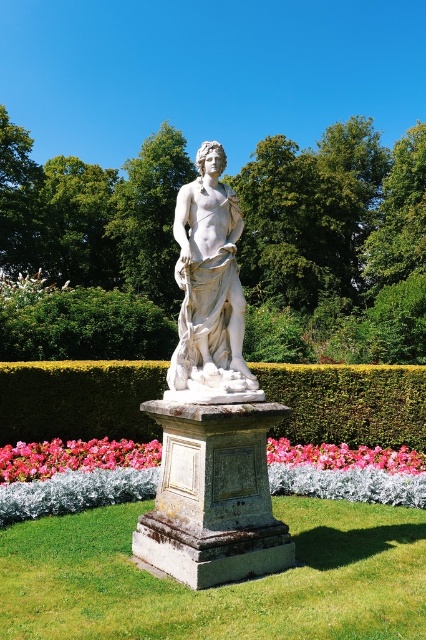
Question: Considering the relative positions of pink fabric flower at lower center and pink floral bed at lower center in the image provided, where is pink fabric flower at lower center located with respect to pink floral bed at lower center?

Choices:
 (A) above
 (B) below

Answer: (A)

Question: Which point appears closest to the camera in this image?

Choices:
 (A) (x=339, y=461)
 (B) (x=353, y=435)
 (C) (x=229, y=388)

Answer: (C)

Question: Does white marble statue at center have a lesser width compared to pink floral bed at lower center?

Choices:
 (A) no
 (B) yes

Answer: (B)

Question: Observing the image, what is the correct spatial positioning of white marble statue at center in reference to pink fabric flower at lower center?

Choices:
 (A) left
 (B) right

Answer: (B)

Question: Based on their relative distances, which object is nearer to the green hedge at center?

Choices:
 (A) pink fabric flower at lower center
 (B) pink floral bed at lower center

Answer: (B)

Question: Estimate the real-world distances between objects in this image. Which object is farther from the pink floral bed at lower center?

Choices:
 (A) green hedge at center
 (B) white marble statue at center
 (C) pink fabric flower at lower center

Answer: (B)